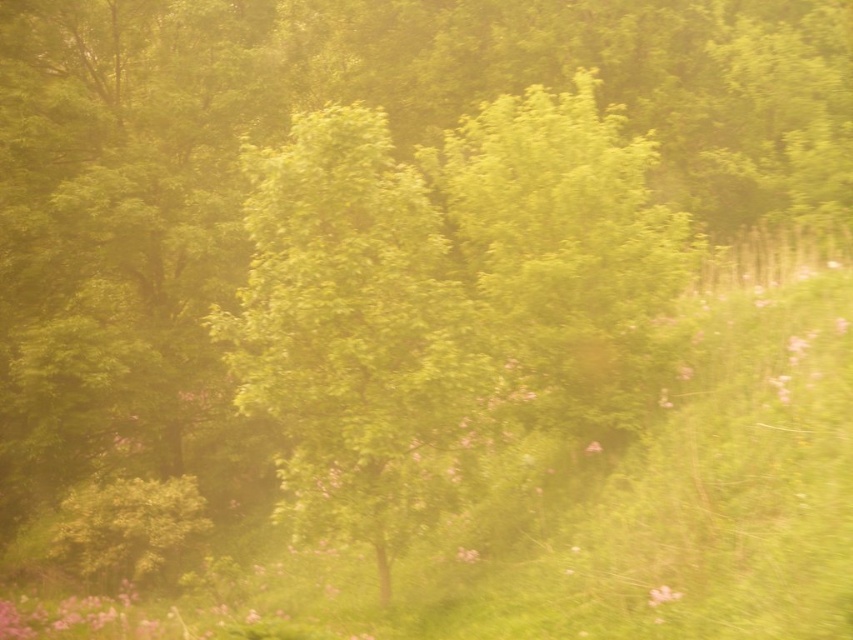
Measure the distance from green leafy tree at center to soft pink petals at center.

The distance of green leafy tree at center from soft pink petals at center is 10.21 feet.

Does green leafy tree at center appear over soft pink petals at center?

Indeed, green leafy tree at center is positioned over soft pink petals at center.

The image size is (853, 640). What do you see at coordinates (352, 332) in the screenshot?
I see `green leafy tree at center` at bounding box center [352, 332].

You are a GUI agent. You are given a task and a screenshot of the screen. Output one action in this format:
    pyautogui.click(x=<x>, y=<y>)
    Task: Click on the green leafy tree at center
    This screenshot has width=853, height=640.
    Given the screenshot: What is the action you would take?
    point(352,332)